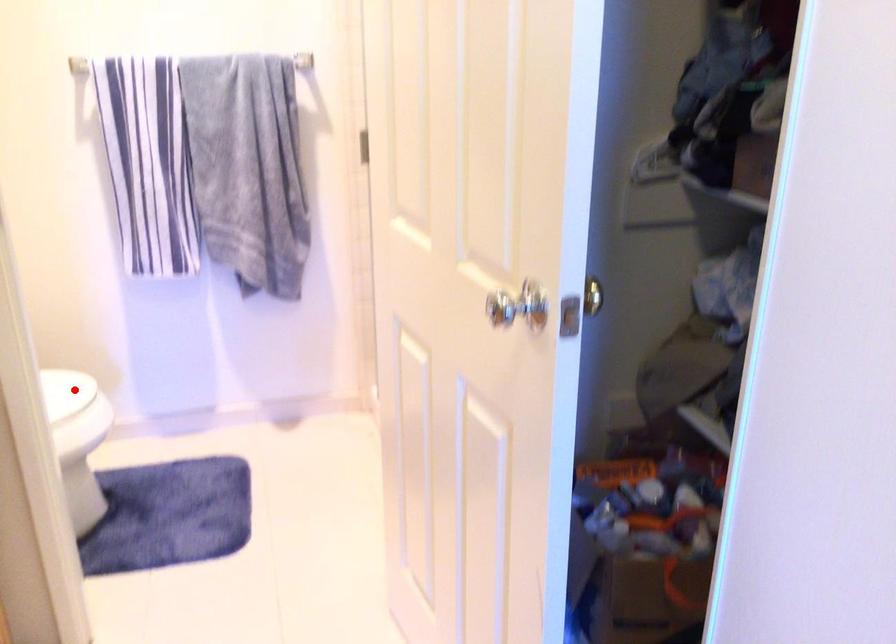
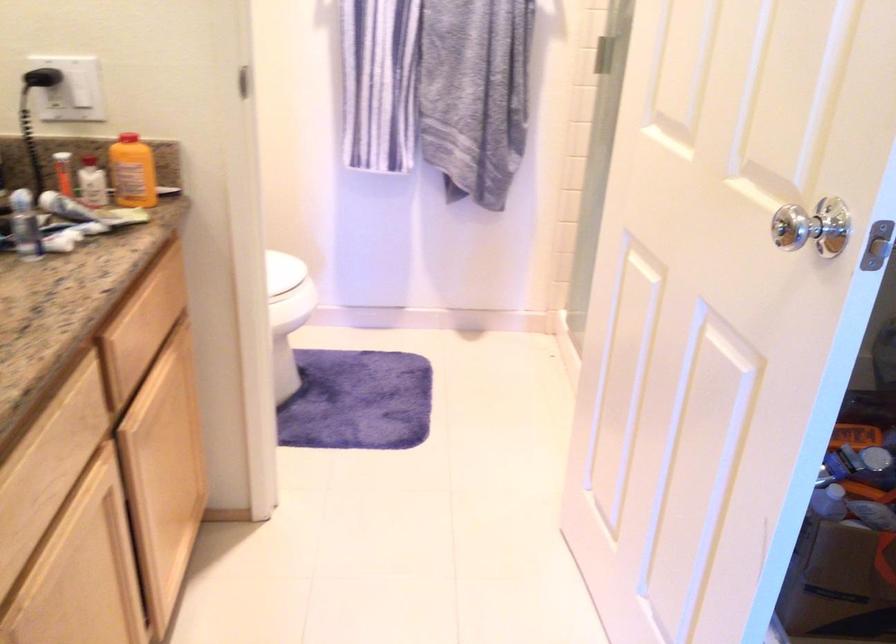
Where in the second image is the point corresponding to the highlighted location from the first image?

(282, 270)